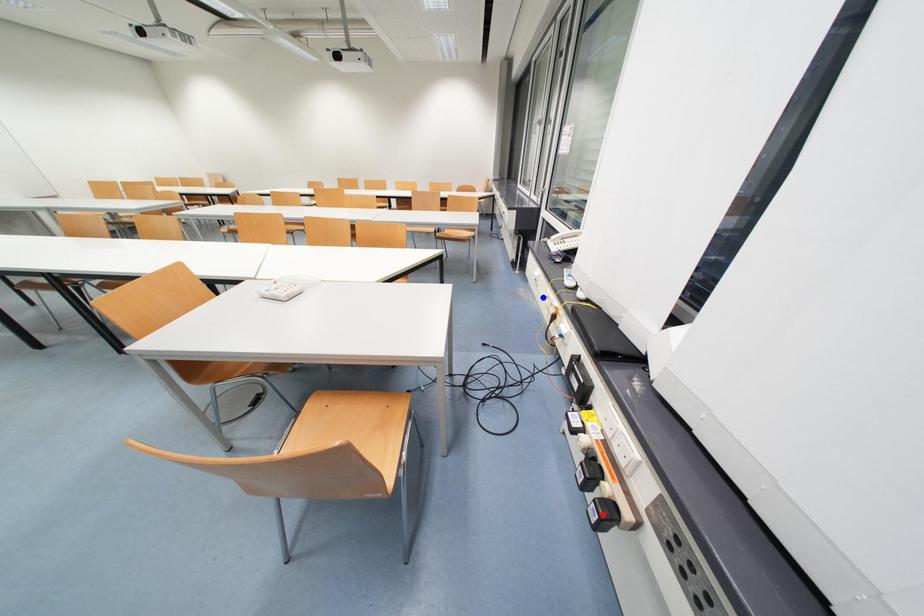
Question: In the image, two points are highlighted. Which point is nearer to the camera? Reply with the corresponding letter.

Choices:
 (A) blue point
 (B) red point

Answer: (B)